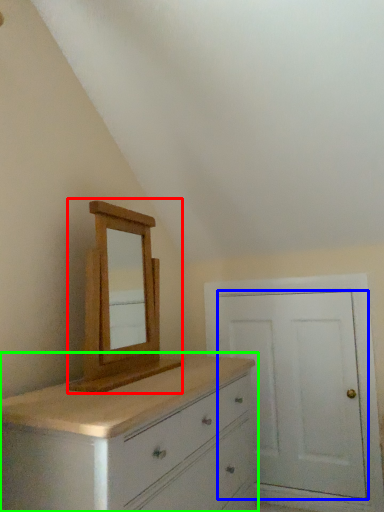
Question: Considering the real-world distances, which object is closest to medicine cabinet (highlighted by a red box)? door (highlighted by a blue box) or chest of drawers (highlighted by a green box).

Choices:
 (A) door
 (B) chest of drawers

Answer: (B)